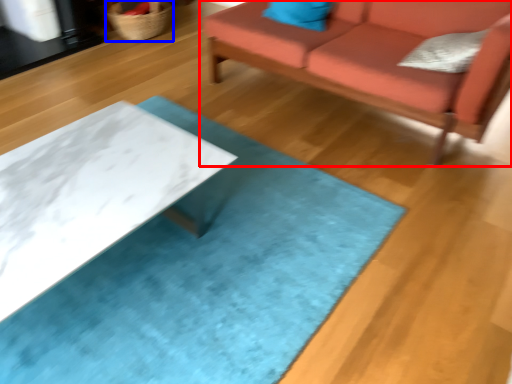
Question: Among these objects, which one is nearest to the camera, studio couch (highlighted by a red box) or basket (highlighted by a blue box)?

Choices:
 (A) studio couch
 (B) basket

Answer: (A)